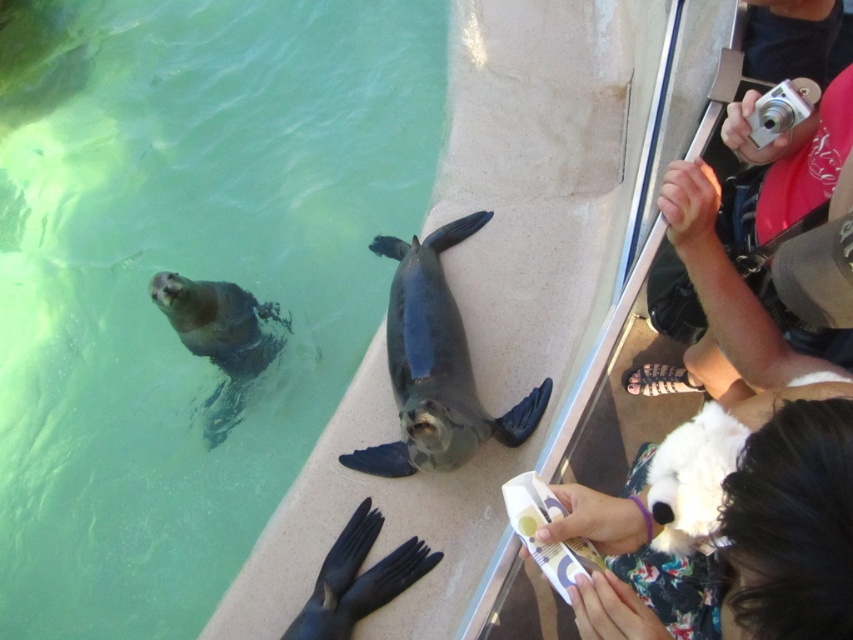
Question: In this image, where is green smooth water at upper left located relative to black rubber fins at lower center?

Choices:
 (A) right
 (B) left

Answer: (B)

Question: Among these points, which one is farthest from the camera?

Choices:
 (A) (628, 557)
 (B) (218, 387)
 (C) (396, 573)
 (D) (462, 234)

Answer: (B)

Question: Which object is closer to the camera taking this photo?

Choices:
 (A) gray matte penguin at lower left
 (B) shiny dark gray penguin at center
 (C) green smooth water at upper left

Answer: (B)

Question: Does green smooth water at upper left come behind gray matte penguin at lower left?

Choices:
 (A) no
 (B) yes

Answer: (A)

Question: Is green smooth water at upper left to the left of gray matte penguin at lower left from the viewer's perspective?

Choices:
 (A) yes
 (B) no

Answer: (A)

Question: Which of the following is the farthest from the observer?

Choices:
 (A) black rubber fins at lower center
 (B) shiny dark gray penguin at center
 (C) green smooth water at upper left

Answer: (C)